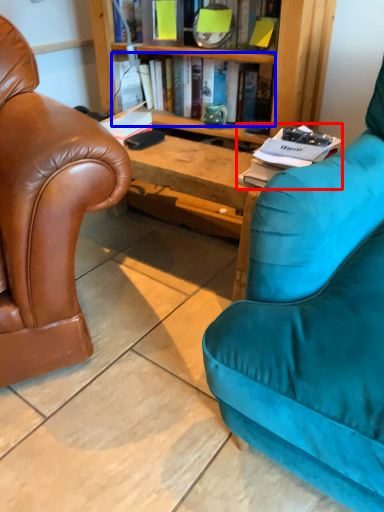
Question: Among these objects, which one is farthest to the camera, book (highlighted by a red box) or book (highlighted by a blue box)?

Choices:
 (A) book
 (B) book

Answer: (B)